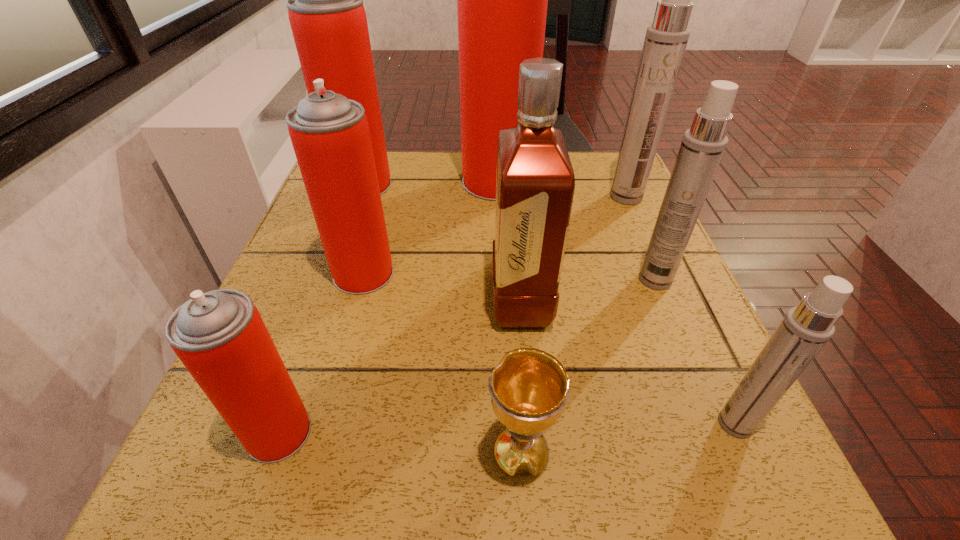
This screenshot has height=540, width=960. Find the location of `the tallest object`. the tallest object is located at coordinates (502, 0).

What are the coordinates of `the fourth aerosol can from right to left` in the screenshot? It's located at (502, 0).

Locate an element on the screen. Image resolution: width=960 pixels, height=540 pixels. the third smallest red aerosol can is located at coordinates (325, 6).

This screenshot has width=960, height=540. In order to click on the farthest white aerosol can in this screenshot , I will do `click(666, 39)`.

The image size is (960, 540). I want to click on liquor, so [x=535, y=183].

Image resolution: width=960 pixels, height=540 pixels. Find the location of `the second nearest red aerosol can`. the second nearest red aerosol can is located at coordinates (330, 135).

Where is `the second farthest white aerosol can`? the second farthest white aerosol can is located at coordinates (703, 145).

I want to click on the nearest red aerosol can, so click(x=220, y=337).

Identify the location of the smallest white aerosol can. The width and height of the screenshot is (960, 540). (805, 329).

Image resolution: width=960 pixels, height=540 pixels. Identify the location of chalice. (529, 387).